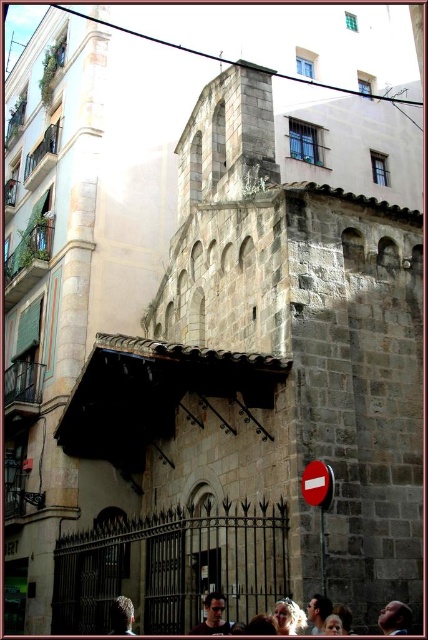
You are a tourist standing in front of the historical stone structure. You see the red plastic sign at center and the smooth brown hair at center. Which object is located higher from the ground?

The red plastic sign at center is above smooth brown hair at center, so it is higher from the ground.

You are a tourist standing in front of the historical stone structure. You notice the red plastic sign at lower right and the smooth skin face at center. Which object is smaller in size?

The red plastic sign at lower right has a smaller size compared to the smooth skin face at center, so the red plastic sign at lower right is smaller.

You are a tourist standing at the camera position in front of the historical stone structure. You want to read the red plastic sign at lower right. Is it possible for you to reach the sign without moving from your current position?

The red plastic sign at lower right is 34.76 meters from camera, so it is too far away to read without moving closer. You will need to approach the sign to read it.